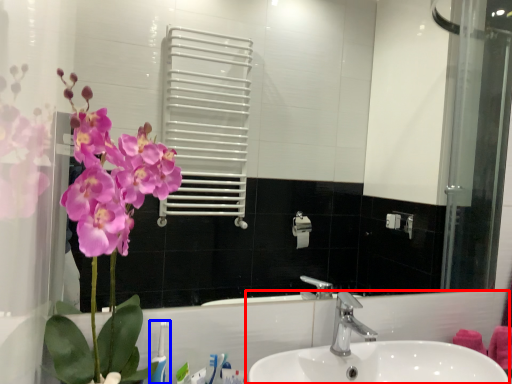
Question: Which of the following is the closest to the observer, sink (highlighted by a red box) or toothbrush (highlighted by a blue box)?

Choices:
 (A) sink
 (B) toothbrush

Answer: (A)